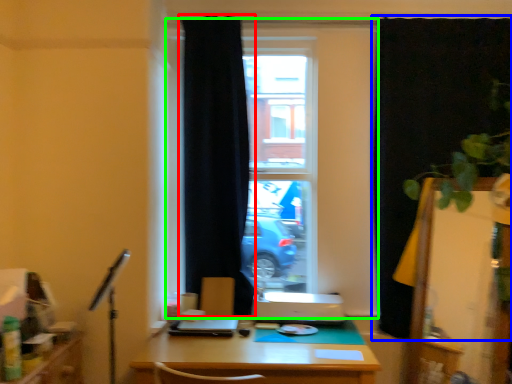
Question: Which object is the closest to the curtain (highlighted by a red box)? Choose among these: curtain (highlighted by a blue box) or window (highlighted by a green box).

Choices:
 (A) curtain
 (B) window

Answer: (B)